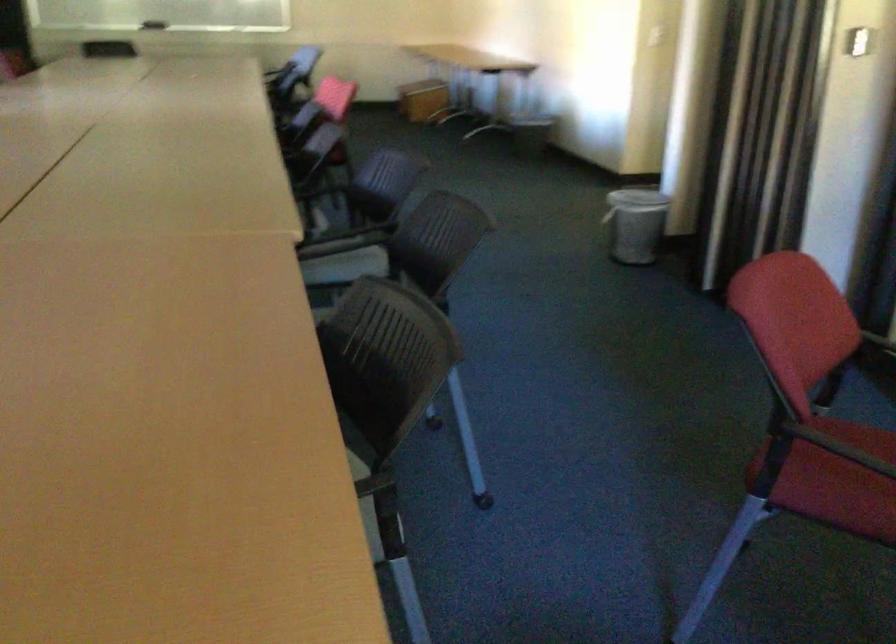
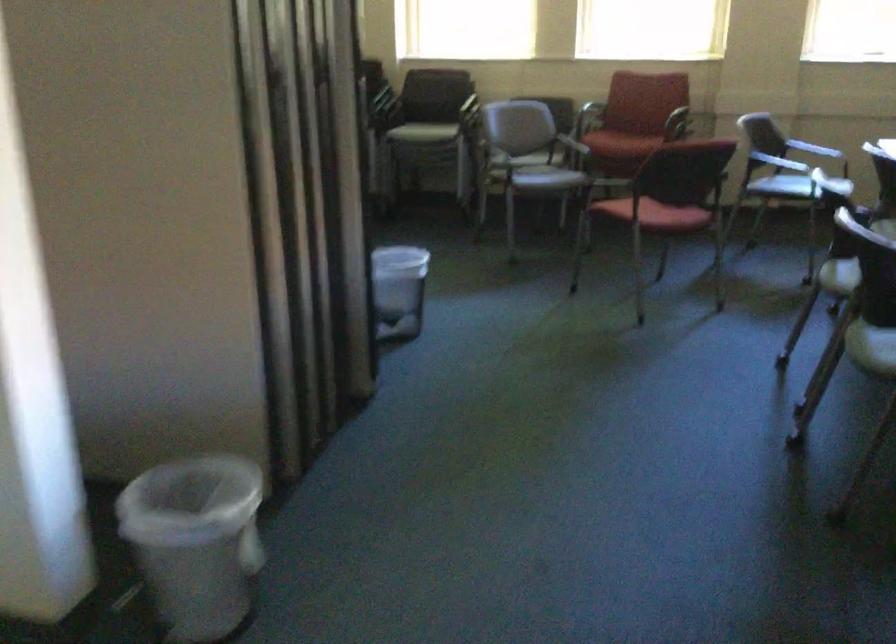
The point at (819,453) is marked in the first image. Where is the corresponding point in the second image?

(660, 214)